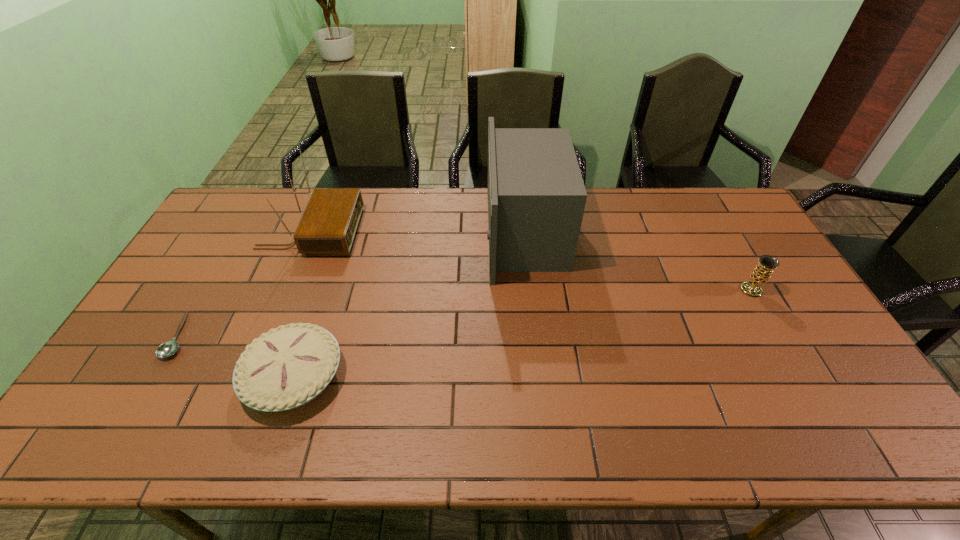
Where is `microwave oven`? microwave oven is located at coordinates (536, 195).

The height and width of the screenshot is (540, 960). What are the coordinates of `the second tallest object` in the screenshot? It's located at click(328, 225).

This screenshot has width=960, height=540. I want to click on chalice, so [762, 272].

Where is `the rightmost object`? the rightmost object is located at coordinates (762, 272).

The width and height of the screenshot is (960, 540). In order to click on pie in this screenshot , I will do `click(287, 367)`.

Locate an element on the screen. The height and width of the screenshot is (540, 960). the leftmost object is located at coordinates (167, 349).

Where is `the shortest object`? This screenshot has width=960, height=540. the shortest object is located at coordinates (167, 349).

Identify the location of vacant space located on the front-facing side of the second object from right to left. (407, 233).

You are a GUI agent. You are given a task and a screenshot of the screen. Output one action in this format:
    pyautogui.click(x=<x>, y=<y>)
    Task: Click on the free space located 0.270m on the front-facing side of the second object from right to left
    The width and height of the screenshot is (960, 540).
    Given the screenshot: What is the action you would take?
    pyautogui.click(x=407, y=233)

What are the coordinates of `free spot located on the front-facing side of the second object from right to left` in the screenshot? It's located at (377, 233).